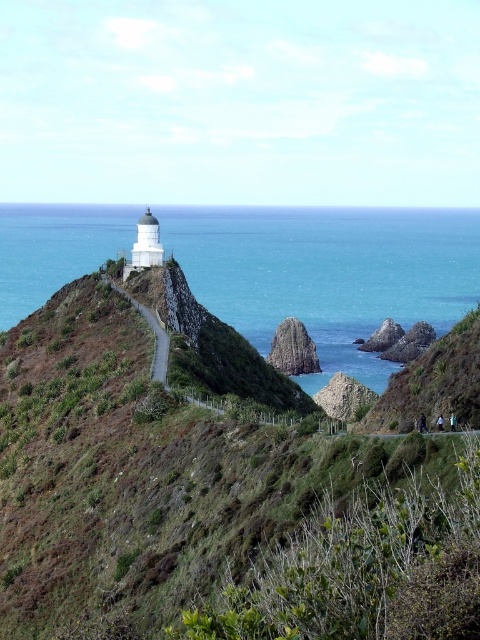
In the scene shown: Who is positioned more to the left, green grassy hillside at upper left or blue water at upper center?

green grassy hillside at upper left

How much distance is there between green grassy hillside at upper left and blue water at upper center?

green grassy hillside at upper left and blue water at upper center are 666.25 feet apart from each other.

Does point (267, 573) lie in front of point (182, 211)?

That is True.

This screenshot has height=640, width=480. In order to click on green grassy hillside at upper left in this screenshot , I will do `click(211, 502)`.